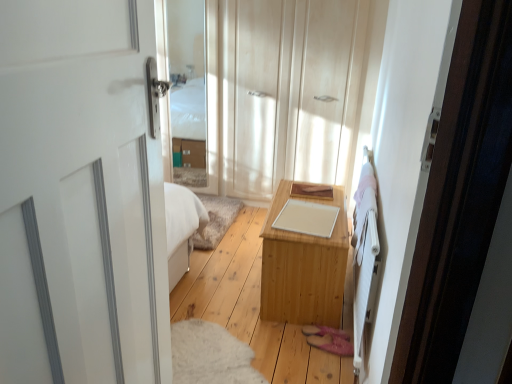
Question: Based on their sizes in the image, would you say white glossy door at left is bigger or smaller than light wood dresser at center?

Choices:
 (A) big
 (B) small

Answer: (A)

Question: Do you think white glossy door at left is within light wood dresser at center, or outside of it?

Choices:
 (A) inside
 (B) outside

Answer: (B)

Question: Estimate the real-world distances between objects in this image. Which object is closer to the light wood dresser at center?

Choices:
 (A) white wooden bed frame at right
 (B) white glossy door at left
 (C) light wood table at center
 (D) clear glass mirror at upper center

Answer: (D)

Question: Estimate the real-world distances between objects in this image. Which object is closer to the clear glass mirror at upper center?

Choices:
 (A) white glossy door at left
 (B) white wooden bed frame at right
 (C) light wood dresser at center
 (D) light wood table at center

Answer: (C)